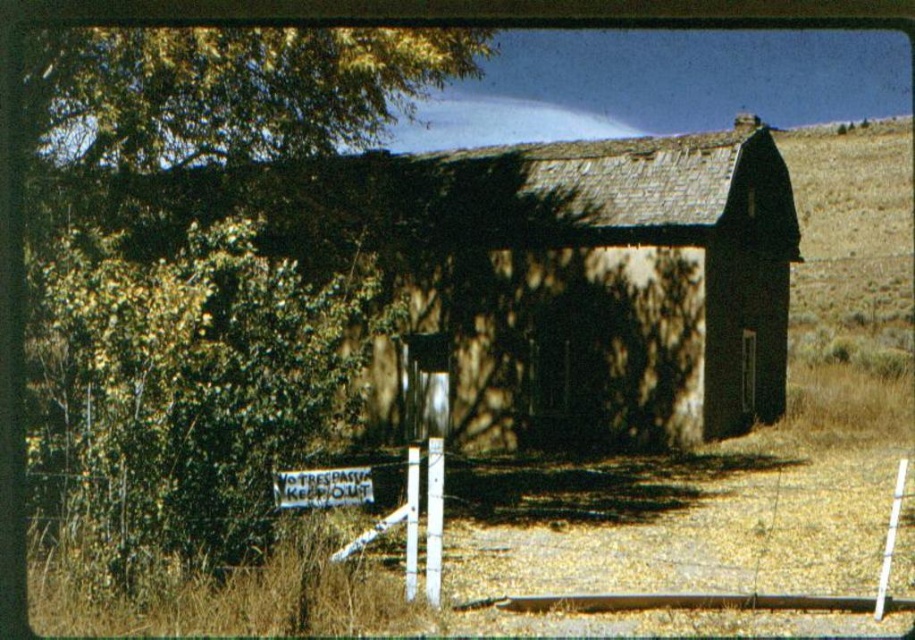
Is dark brown stone barn at center below white wire fence at lower center?

No.

Looking at this image, is dark brown stone barn at center closer to camera compared to white wire fence at lower center?

No, it is behind white wire fence at lower center.

Which is behind, point (357, 193) or point (472, 579)?

Point (357, 193)

Identify the location of dark brown stone barn at center. (576, 276).

Is dark brown stone barn at center wider than white wire fence at lower left?

Yes.

In the scene shown: Is dark brown stone barn at center bigger than white wire fence at lower left?

Indeed, dark brown stone barn at center has a larger size compared to white wire fence at lower left.

Is point (502, 404) closer to camera compared to point (89, 614)?

No, it is not.

This screenshot has width=915, height=640. I want to click on dark brown stone barn at center, so click(576, 276).

Between green leafy tree at left and white wire fence at lower left, which one is positioned lower?

Positioned lower is white wire fence at lower left.

Is green leafy tree at left positioned before white wire fence at lower left?

That is True.

Which is behind, point (44, 371) or point (289, 552)?

Positioned behind is point (44, 371).

Identify the location of green leafy tree at left. (205, 260).